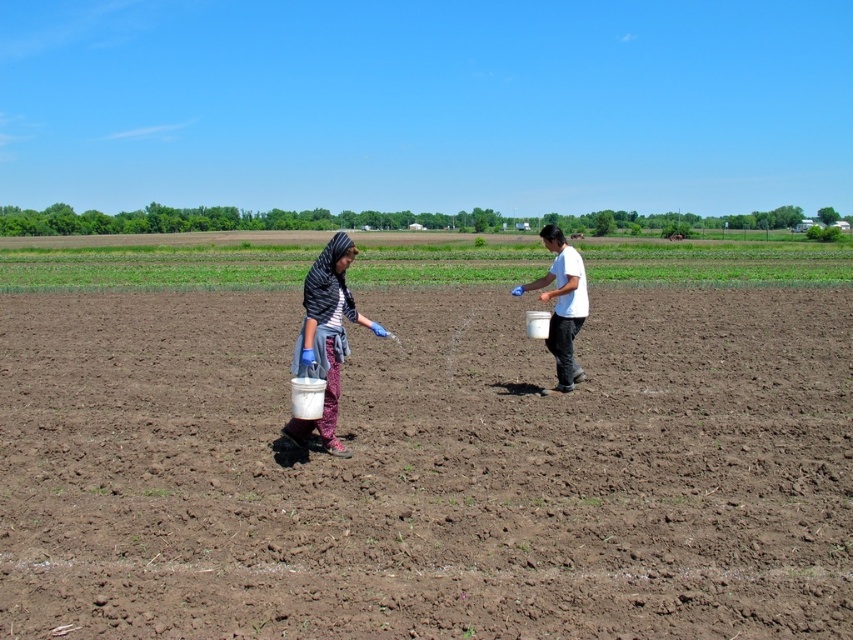
Question: From the image, what is the correct spatial relationship of brown soil at center in relation to white matte bucket at center?

Choices:
 (A) below
 (B) above

Answer: (A)

Question: Is matte black bucket at center wider than white matte bucket at center?

Choices:
 (A) yes
 (B) no

Answer: (B)

Question: Does brown soil at center lie in front of white matte bucket at center?

Choices:
 (A) no
 (B) yes

Answer: (B)

Question: Which of the following is the farthest from the observer?

Choices:
 (A) matte black bucket at center
 (B) white matte bucket at center
 (C) white plastic bucket at center

Answer: (B)

Question: Estimate the real-world distances between objects in this image. Which object is farther from the matte black bucket at center?

Choices:
 (A) white matte bucket at center
 (B) brown soil at center

Answer: (A)

Question: Which object is the closest to the white matte bucket at center?

Choices:
 (A) brown soil at center
 (B) white plastic bucket at center

Answer: (A)